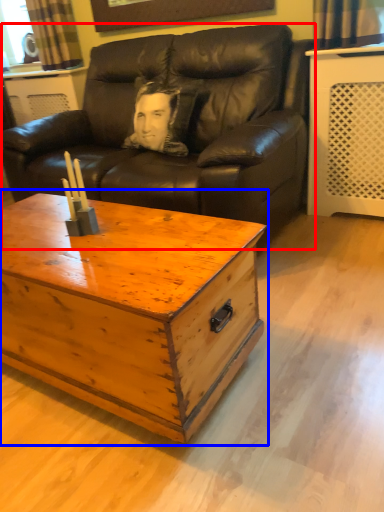
Question: Among these objects, which one is nearest to the camera, studio couch (highlighted by a red box) or coffee table (highlighted by a blue box)?

Choices:
 (A) studio couch
 (B) coffee table

Answer: (B)